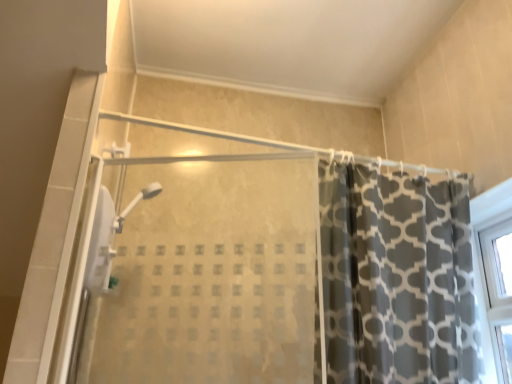
Image resolution: width=512 pixels, height=384 pixels. Describe the element at coordinates (396, 277) in the screenshot. I see `dark gray printed fabric curtain at right` at that location.

Find the location of a particular element. The width and height of the screenshot is (512, 384). dark gray printed fabric curtain at right is located at coordinates (396, 277).

The image size is (512, 384). I want to click on transparent glass shower door at center, so click(x=207, y=269).

Describe the element at coordinates (207, 269) in the screenshot. I see `transparent glass shower door at center` at that location.

You are a GUI agent. You are given a task and a screenshot of the screen. Output one action in this format:
    pyautogui.click(x=<x>, y=<y>)
    Task: Click on the dark gray printed fabric curtain at right
    The width and height of the screenshot is (512, 384).
    Given the screenshot: What is the action you would take?
    point(396,277)

Can you confirm if transparent glass shower door at center is positioned to the right of dark gray printed fabric curtain at right?

No.

Considering the relative positions of transparent glass shower door at center and dark gray printed fabric curtain at right in the image provided, is transparent glass shower door at center in front of dark gray printed fabric curtain at right?

Yes, the depth of transparent glass shower door at center is less than that of dark gray printed fabric curtain at right.

Is point (110, 275) less distant than point (350, 335)?

No, it is behind (350, 335).

From the image's perspective, which object appears higher, transparent glass shower door at center or dark gray printed fabric curtain at right?

transparent glass shower door at center, from the image's perspective.

From a real-world perspective, which object stands above the other?

From a 3D spatial view, dark gray printed fabric curtain at right is above.

Which of these two, transparent glass shower door at center or dark gray printed fabric curtain at right, is wider?

Wider between the two is dark gray printed fabric curtain at right.

Who is shorter, transparent glass shower door at center or dark gray printed fabric curtain at right?

With less height is transparent glass shower door at center.

Is transparent glass shower door at center bigger or smaller than dark gray printed fabric curtain at right?

Clearly, transparent glass shower door at center is smaller in size than dark gray printed fabric curtain at right.

Is transparent glass shower door at center not within dark gray printed fabric curtain at right?

That's correct, transparent glass shower door at center is outside of dark gray printed fabric curtain at right.

Looking at this image, is transparent glass shower door at center far away from dark gray printed fabric curtain at right?

They are positioned close to each other.

Is transparent glass shower door at center facing towards dark gray printed fabric curtain at right?

No, transparent glass shower door at center is not aimed at dark gray printed fabric curtain at right.

The width and height of the screenshot is (512, 384). I want to click on curtain that is on the right side of transparent glass shower door at center, so click(x=396, y=277).

Which object is positioned more to the right, dark gray printed fabric curtain at right or transparent glass shower door at center?

dark gray printed fabric curtain at right is more to the right.

Relative to transparent glass shower door at center, is dark gray printed fabric curtain at right in front or behind?

dark gray printed fabric curtain at right is positioned farther from the viewer than transparent glass shower door at center.

Considering the positions of point (338, 225) and point (205, 132), is point (338, 225) closer or farther from the camera than point (205, 132)?

Point (338, 225) is positioned closer to the camera compared to point (205, 132).

From the image's perspective, which one is positioned lower, dark gray printed fabric curtain at right or transparent glass shower door at center?

dark gray printed fabric curtain at right appears lower in the image.

From a real-world perspective, is dark gray printed fabric curtain at right above or below transparent glass shower door at center?

dark gray printed fabric curtain at right is above transparent glass shower door at center.

Considering the sizes of dark gray printed fabric curtain at right and transparent glass shower door at center in the image, is dark gray printed fabric curtain at right wider or thinner than transparent glass shower door at center?

dark gray printed fabric curtain at right is wider than transparent glass shower door at center.

Considering the sizes of objects dark gray printed fabric curtain at right and transparent glass shower door at center in the image provided, who is taller, dark gray printed fabric curtain at right or transparent glass shower door at center?

dark gray printed fabric curtain at right is taller.

Based on their sizes in the image, would you say dark gray printed fabric curtain at right is bigger or smaller than transparent glass shower door at center?

Considering their sizes, dark gray printed fabric curtain at right takes up more space than transparent glass shower door at center.

Is dark gray printed fabric curtain at right situated inside transparent glass shower door at center or outside?

dark gray printed fabric curtain at right is not inside transparent glass shower door at center, it's outside.

Is there a large distance between dark gray printed fabric curtain at right and transparent glass shower door at center?

dark gray printed fabric curtain at right is near transparent glass shower door at center, not far away.

Is dark gray printed fabric curtain at right facing away from transparent glass shower door at center?

dark gray printed fabric curtain at right is not turned away from transparent glass shower door at center.

Can you tell me how much dark gray printed fabric curtain at right and transparent glass shower door at center differ in facing direction?

dark gray printed fabric curtain at right and transparent glass shower door at center are facing 18.3 degrees away from each other.

How much distance is there between dark gray printed fabric curtain at right and transparent glass shower door at center?

dark gray printed fabric curtain at right is 18.39 inches away from transparent glass shower door at center.

Identify the location of curtain that appears behind the transparent glass shower door at center. The width and height of the screenshot is (512, 384). (396, 277).

Where is `curtain below the transparent glass shower door at center (from the image's perspective)`? curtain below the transparent glass shower door at center (from the image's perspective) is located at coordinates (396, 277).

The height and width of the screenshot is (384, 512). What are the coordinates of `screen door that is on the left side of dark gray printed fabric curtain at right` in the screenshot? It's located at (207, 269).